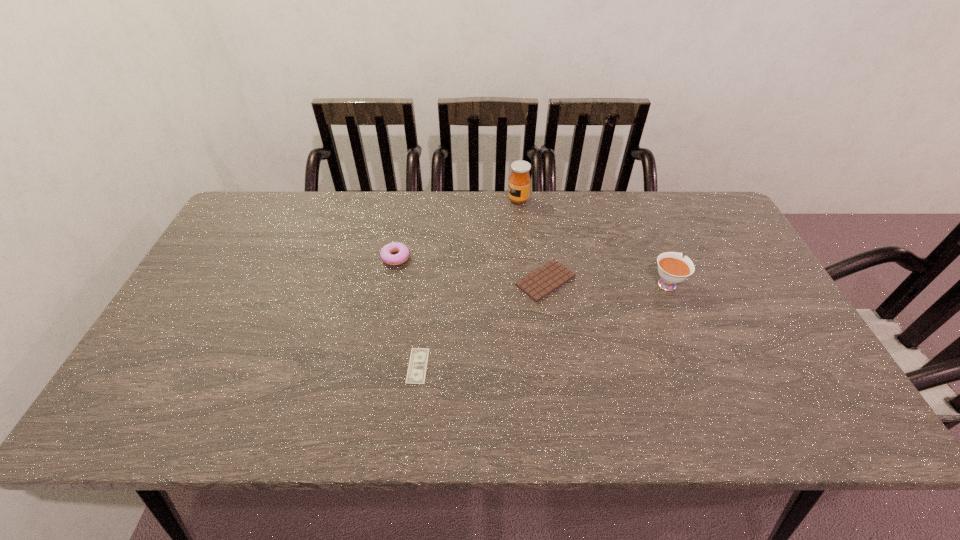
The width and height of the screenshot is (960, 540). What are the coordinates of `vacant region that satisfies the following two spatial constraints: 1. on the front side of the fourth object from right to left; 2. on the right side of the third shortest object` in the screenshot? It's located at (374, 366).

You are a GUI agent. You are given a task and a screenshot of the screen. Output one action in this format:
    pyautogui.click(x=<x>, y=<y>)
    Task: Click on the free space that satisfies the following two spatial constraints: 1. on the front-facing side of the farthest object; 2. on the front side of the nearest object
    The image size is (960, 540).
    Given the screenshot: What is the action you would take?
    pyautogui.click(x=536, y=366)

Where is `vacant region that satisfies the following two spatial constraints: 1. on the side of the teacup with the handle; 2. on the front-facing side of the farthest object`? This screenshot has height=540, width=960. vacant region that satisfies the following two spatial constraints: 1. on the side of the teacup with the handle; 2. on the front-facing side of the farthest object is located at coordinates (633, 200).

Image resolution: width=960 pixels, height=540 pixels. Find the location of `free spot that satisfies the following two spatial constraints: 1. on the back side of the chocolate bar; 2. on the front-facing side of the honey`. free spot that satisfies the following two spatial constraints: 1. on the back side of the chocolate bar; 2. on the front-facing side of the honey is located at coordinates (534, 200).